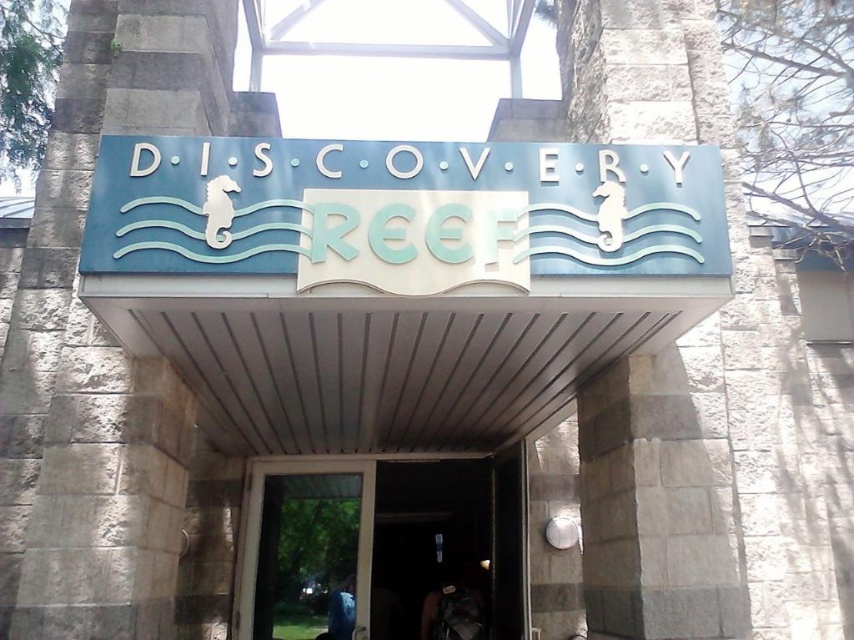
Question: Can you confirm if blue painted metal sign at center is smaller than transparent glass door at center?

Choices:
 (A) yes
 (B) no

Answer: (A)

Question: Does blue painted metal sign at center appear over transparent glass door at center?

Choices:
 (A) yes
 (B) no

Answer: (A)

Question: Does blue painted metal sign at center appear over transparent glass door at center?

Choices:
 (A) no
 (B) yes

Answer: (B)

Question: Which point is closer to the camera?

Choices:
 (A) (463, 248)
 (B) (293, 572)

Answer: (A)

Question: Among these objects, which one is farthest from the camera?

Choices:
 (A) transparent glass door at center
 (B) blue painted metal sign at center

Answer: (A)

Question: Which of the following is the closest to the observer?

Choices:
 (A) (342, 252)
 (B) (358, 556)

Answer: (A)